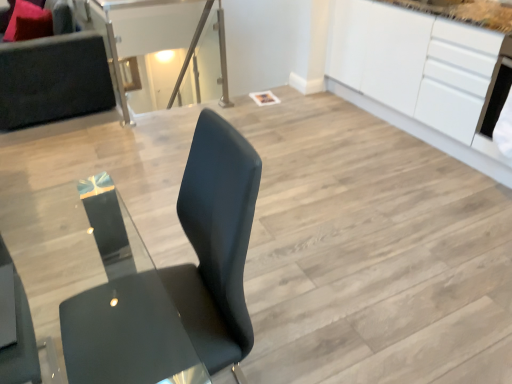
You are a GUI agent. You are given a task and a screenshot of the screen. Output one action in this format:
    pyautogui.click(x=<x>, y=<y>)
    Task: Click on the free space to the right of matte black chair at center, marked as the 2th chair in a top-to-bottom arrangement
    This screenshot has height=384, width=512.
    Given the screenshot: What is the action you would take?
    pyautogui.click(x=304, y=342)